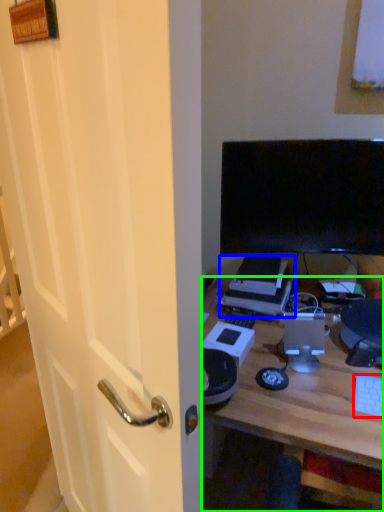
Question: Based on their relative distances, which object is nearer to computer keyboard (highlighted by a red box)? Choose from printer (highlighted by a blue box) and desk (highlighted by a green box).

Choices:
 (A) printer
 (B) desk

Answer: (B)